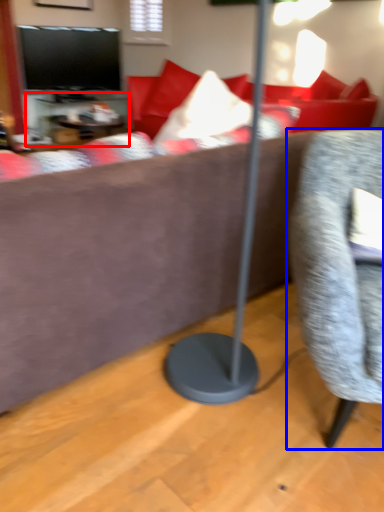
Question: Which object is further to the camera taking this photo, table (highlighted by a red box) or chair (highlighted by a blue box)?

Choices:
 (A) table
 (B) chair

Answer: (A)